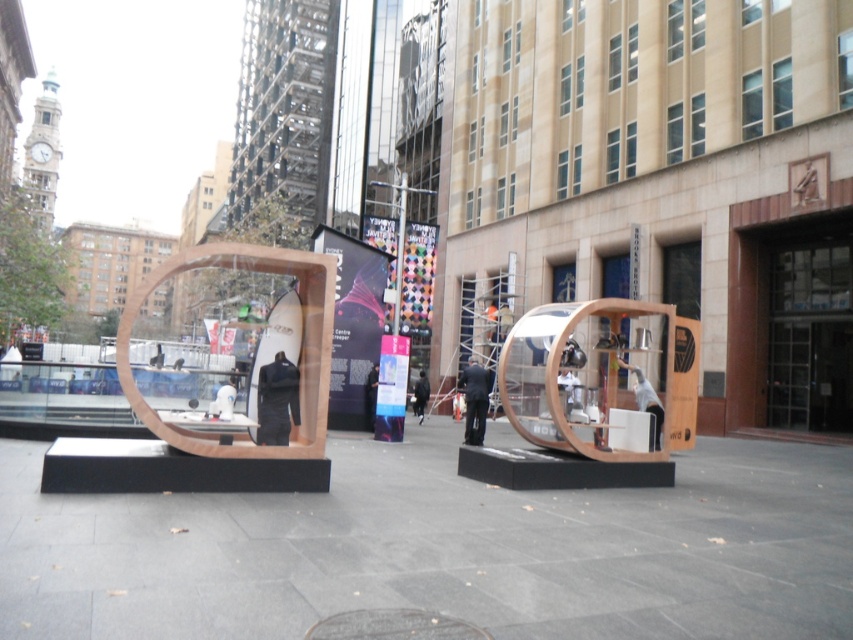
You are a photographer setting up a shot of the modern art installation. You notice a dark fabric jacket at center and a white fabric bag at center in the foreground. Which object should you adjust to avoid blocking the view of the art installation if you want to keep one?

The dark fabric jacket at center might be wider than the white fabric bag at center, so adjusting the jacket would be better to avoid blocking the view since it could take up more space.